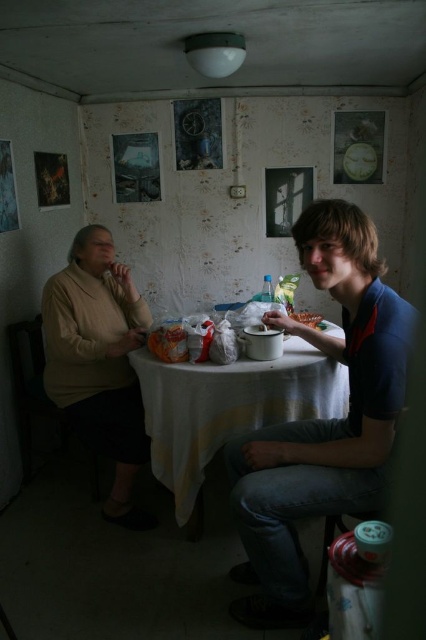
Between point (97, 355) and point (313, 372), which one is positioned behind?

The point (97, 355) is behind.

Can you confirm if matte beige sweater at left is thinner than white cloth table at center?

Indeed, matte beige sweater at left has a lesser width compared to white cloth table at center.

Who is more forward, [100,259] or [184,416]?

Point [184,416]

Find the location of `matte beige sweater at left`. matte beige sweater at left is located at coordinates (98, 360).

Can you confirm if blue cotton shirt at right is shorter than matte beige sweater at left?

No, blue cotton shirt at right is not shorter than matte beige sweater at left.

Between blue cotton shirt at right and matte beige sweater at left, which one is positioned lower?

Positioned lower is blue cotton shirt at right.

Who is more forward, (x=238, y=444) or (x=144, y=458)?

Point (x=238, y=444)

The width and height of the screenshot is (426, 640). Find the location of `blue cotton shirt at right`. blue cotton shirt at right is located at coordinates (322, 419).

At what (x,y) coordinates should I click in order to perform the action: click on blue cotton shirt at right. Please return your answer as a coordinate pair (x, y). Looking at the image, I should click on (322, 419).

Is point (337, 292) farther from camera compared to point (316, 326)?

No, (337, 292) is in front of (316, 326).

This screenshot has width=426, height=640. I want to click on blue cotton shirt at right, so click(x=322, y=419).

Where is `blue cotton shirt at right`? blue cotton shirt at right is located at coordinates (322, 419).